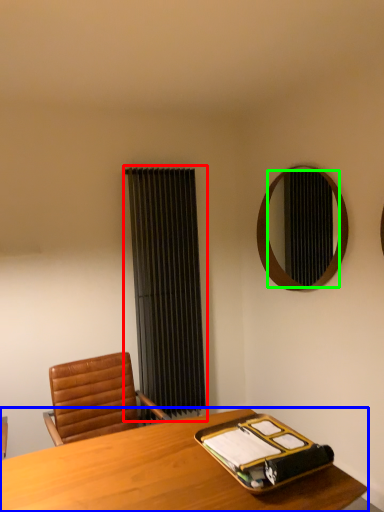
Question: Estimate the real-world distances between objects in this image. Which object is closer to curtain (highlighted by a red box), desk (highlighted by a blue box) or mirror (highlighted by a green box)?

Choices:
 (A) desk
 (B) mirror

Answer: (B)